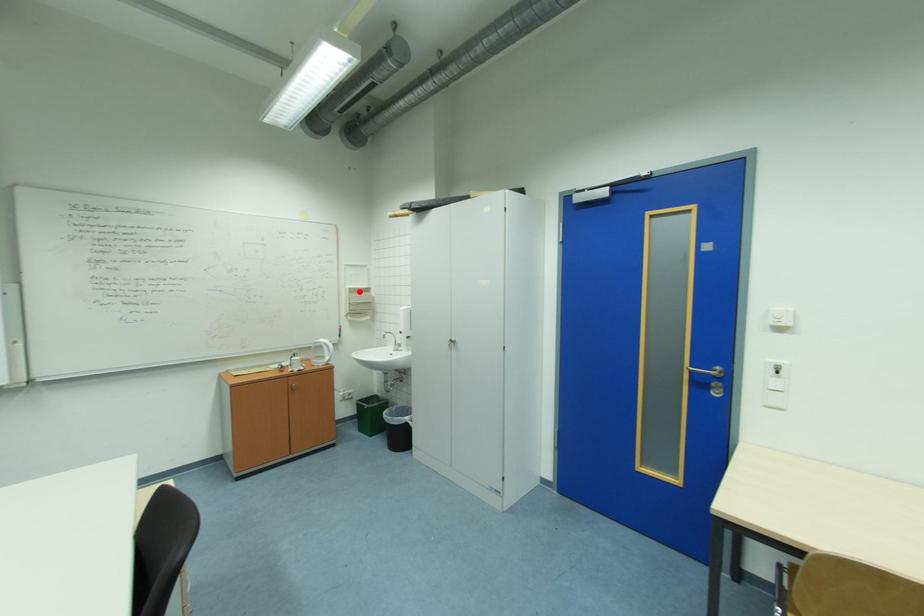
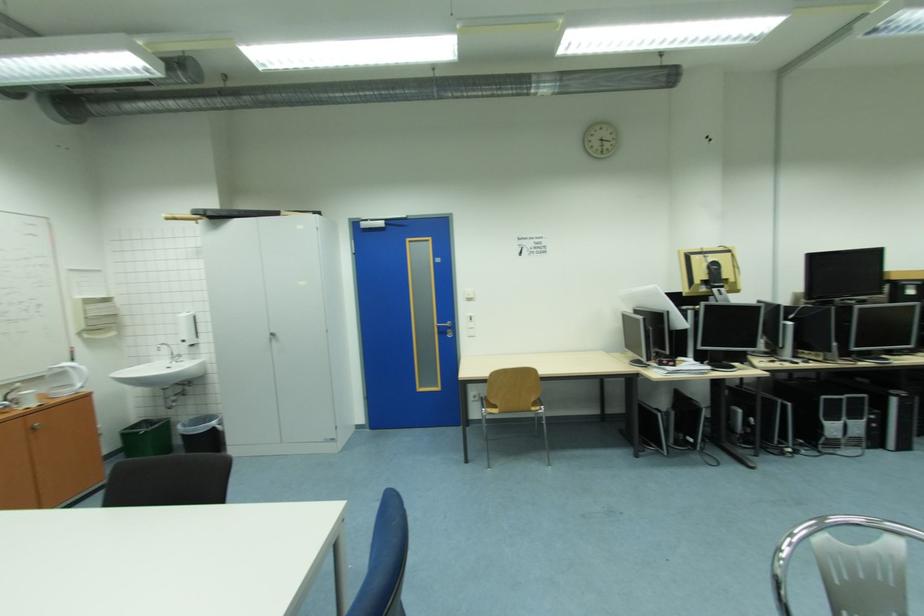
Question: I am providing you with two images of the same scene from different viewpoints. A red point is marked on the first image. Can you still see the location of the red point in image 2?

Choices:
 (A) Yes
 (B) No

Answer: (A)